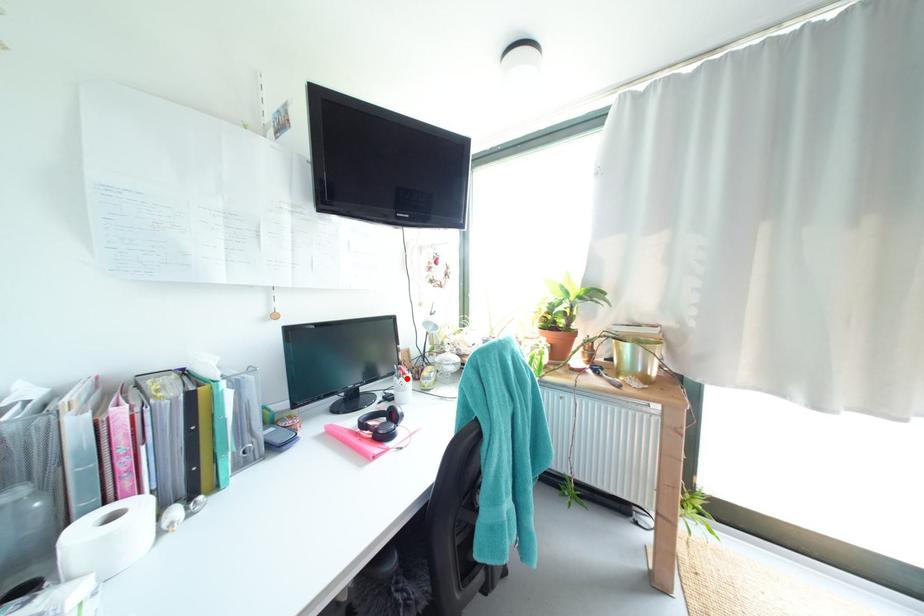
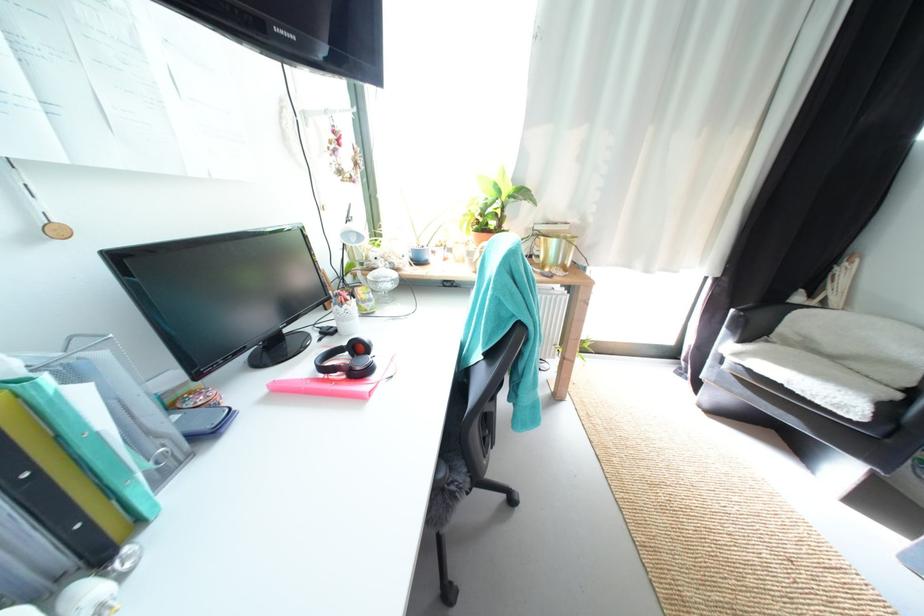
Where in the second image is the point corresponding to the highlighted location from the first image?

(348, 306)